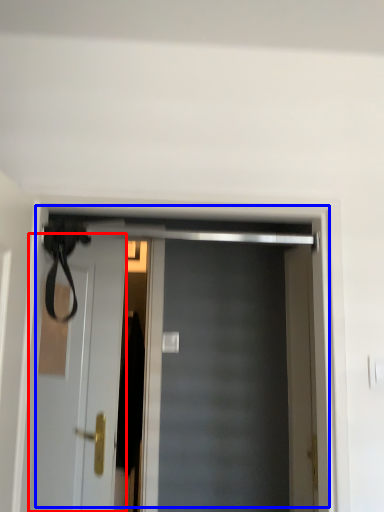
Question: Which object is further to the camera taking this photo, door (highlighted by a red box) or door (highlighted by a blue box)?

Choices:
 (A) door
 (B) door

Answer: (A)